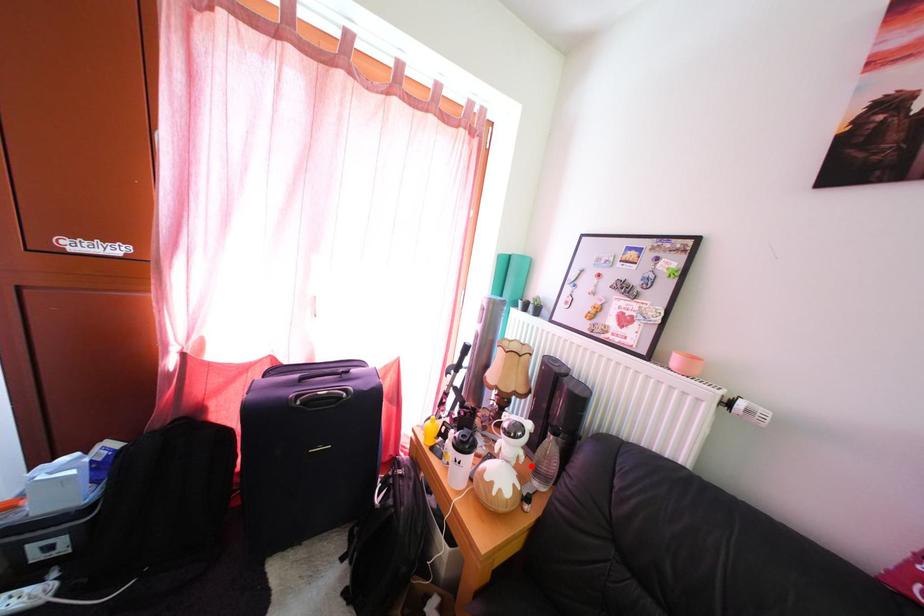
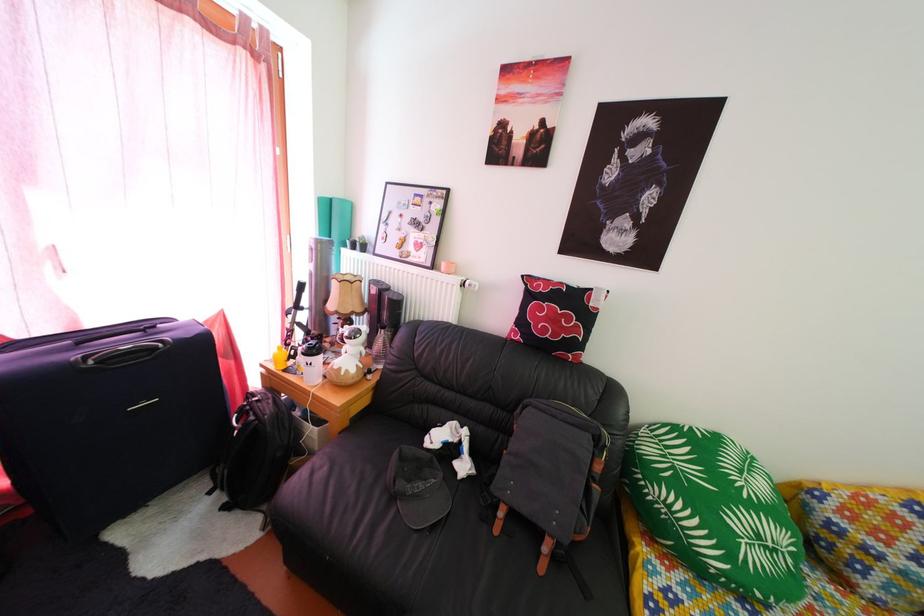
Find the pixel in the second image that matches the highlighted location in the first image.

(372, 361)